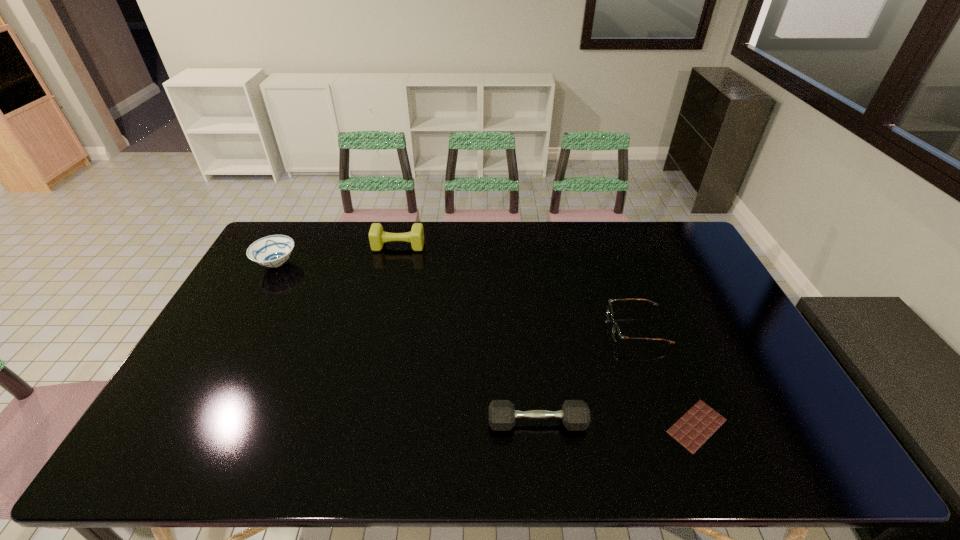
The height and width of the screenshot is (540, 960). What are the coordinates of `free space located 0.050m on the left of the third object from left to right` in the screenshot? It's located at (468, 423).

Find the location of `vacant space located 0.390m on the front-facing side of the fourth tallest object`. vacant space located 0.390m on the front-facing side of the fourth tallest object is located at coordinates (478, 329).

Locate an element on the screen. The width and height of the screenshot is (960, 540). vacant space situated 0.150m on the front-facing side of the fourth tallest object is located at coordinates point(559,329).

I want to click on vacant space situated 0.050m on the front-facing side of the fourth tallest object, so click(x=592, y=329).

This screenshot has height=540, width=960. In order to click on vacant space located on the back of the shortest object in this screenshot , I will do `click(650, 311)`.

What are the coordinates of `dumbbell located in the far edge section of the desktop` in the screenshot? It's located at (377, 237).

Locate an element on the screen. soup bowl located in the far edge section of the desktop is located at coordinates (272, 251).

The width and height of the screenshot is (960, 540). Find the location of `dumbbell that is at the near edge`. dumbbell that is at the near edge is located at coordinates (575, 414).

Locate an element on the screen. This screenshot has width=960, height=540. chocolate bar at the near edge is located at coordinates (698, 424).

Where is `object present at the left edge`? This screenshot has width=960, height=540. object present at the left edge is located at coordinates (272, 251).